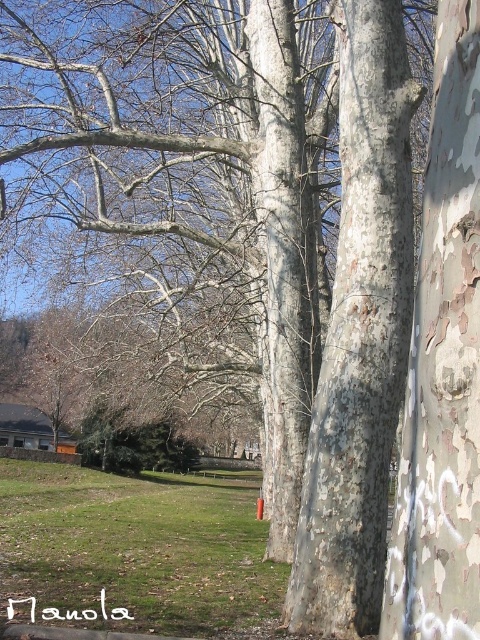
Describe the element at coordinates (443, 365) in the screenshot. I see `white textured bark at center` at that location.

Does white textured bark at center come behind green grass at lower left?

No, white textured bark at center is closer to the viewer.

This screenshot has height=640, width=480. Find the location of `white textured bark at center`. white textured bark at center is located at coordinates pyautogui.click(x=443, y=365).

Looking at this image, between smooth gray bark at center and green grass at lower left, which one is positioned higher?

smooth gray bark at center is above.

Locate an element on the screen. This screenshot has height=640, width=480. smooth gray bark at center is located at coordinates (360, 336).

This screenshot has height=640, width=480. Find the location of `smooth gray bark at center`. smooth gray bark at center is located at coordinates (360, 336).

Find the location of `smooth gray bark at center`. smooth gray bark at center is located at coordinates (360, 336).

Describe the element at coordinates (360, 336) in the screenshot. This screenshot has height=640, width=480. I see `smooth gray bark at center` at that location.

Is point (377, 556) less distant than point (420, 602)?

No, it is behind (420, 602).

Where is `smooth gray bark at center`? This screenshot has width=480, height=640. smooth gray bark at center is located at coordinates (360, 336).